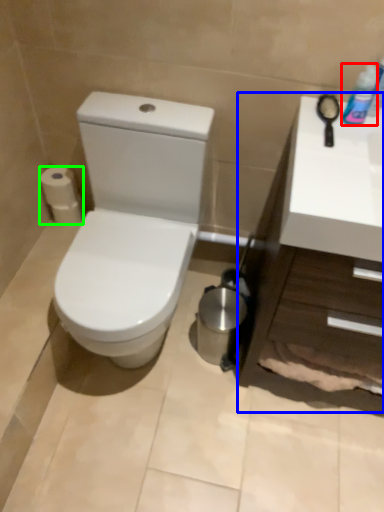
Question: Estimate the real-world distances between objects in this image. Which object is closer to mouthwash (highlighted by a red box), counter top (highlighted by a blue box) or toilet paper (highlighted by a green box)?

Choices:
 (A) counter top
 (B) toilet paper

Answer: (A)